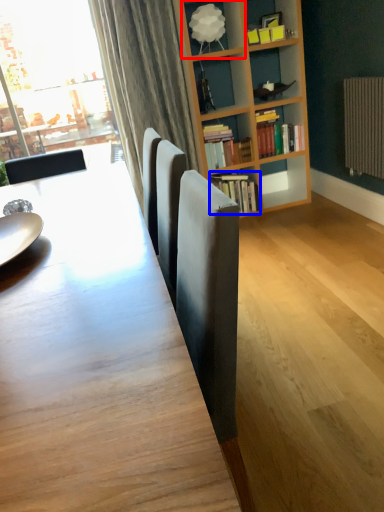
Question: Which of the following is the closest to the observer, shelf (highlighted by a red box) or book (highlighted by a blue box)?

Choices:
 (A) shelf
 (B) book

Answer: (A)